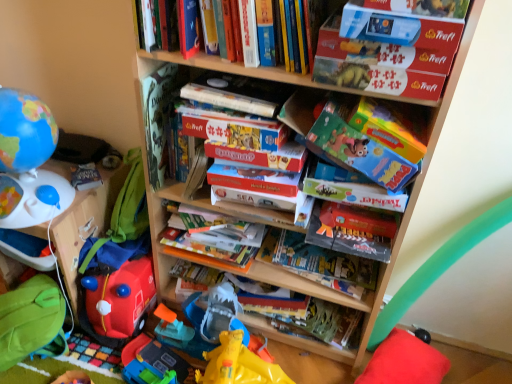
Question: Does hardcover book at center, arranged as the first book when ordered from the bottom, have a larger size compared to red plush pillow at lower right?

Choices:
 (A) yes
 (B) no

Answer: (B)

Question: From the image's perspective, is hardcover book at center, placed as the 4th book when sorted from top to bottom, above red plush pillow at lower right?

Choices:
 (A) yes
 (B) no

Answer: (A)

Question: Is hardcover book at center, arranged as the first book when ordered from the bottom, shorter than red plush pillow at lower right?

Choices:
 (A) no
 (B) yes

Answer: (A)

Question: Does hardcover book at center, placed as the 4th book when sorted from top to bottom, lie in front of red plush pillow at lower right?

Choices:
 (A) yes
 (B) no

Answer: (B)

Question: Is hardcover book at center, placed as the 4th book when sorted from top to bottom, at the right side of red plush pillow at lower right?

Choices:
 (A) yes
 (B) no

Answer: (B)

Question: Is hardcover book at center, arranged as the first book when ordered from the bottom, smaller than red plush pillow at lower right?

Choices:
 (A) no
 (B) yes

Answer: (B)

Question: Can you confirm if hardcover book at center, the 3th book positioned from the top, is thinner than rubberized red fire truck at lower left, which is counted as the 1th toy, starting from the bottom?

Choices:
 (A) no
 (B) yes

Answer: (B)

Question: Does hardcover book at center, the 3th book positioned from the top, have a greater width compared to rubberized red fire truck at lower left, the second toy viewed from the top?

Choices:
 (A) yes
 (B) no

Answer: (B)

Question: Is hardcover book at center, which appears as the 2th book when ordered from the bottom, to the right of rubberized red fire truck at lower left, which is counted as the 1th toy, starting from the bottom, from the viewer's perspective?

Choices:
 (A) no
 (B) yes

Answer: (B)

Question: Is hardcover book at center, which appears as the 2th book when ordered from the bottom, turned away from rubberized red fire truck at lower left, the second toy viewed from the top?

Choices:
 (A) no
 (B) yes

Answer: (A)

Question: Does hardcover book at center, the 3th book positioned from the top, lie behind rubberized red fire truck at lower left, the second toy viewed from the top?

Choices:
 (A) no
 (B) yes

Answer: (A)

Question: Is hardcover book at center, which appears as the 2th book when ordered from the bottom, touching rubberized red fire truck at lower left, which is counted as the 1th toy, starting from the bottom?

Choices:
 (A) yes
 (B) no

Answer: (B)

Question: Is matte cardboard book at center, which ranks as the second paperback book in left-to-right order, surrounded by hardcover book at center, placed as the 4th book when sorted from top to bottom?

Choices:
 (A) yes
 (B) no

Answer: (B)